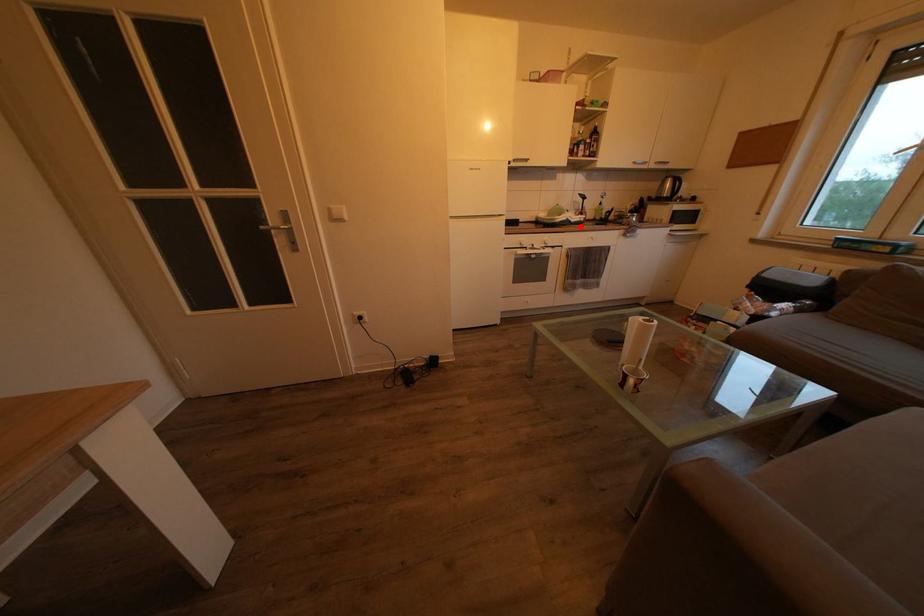
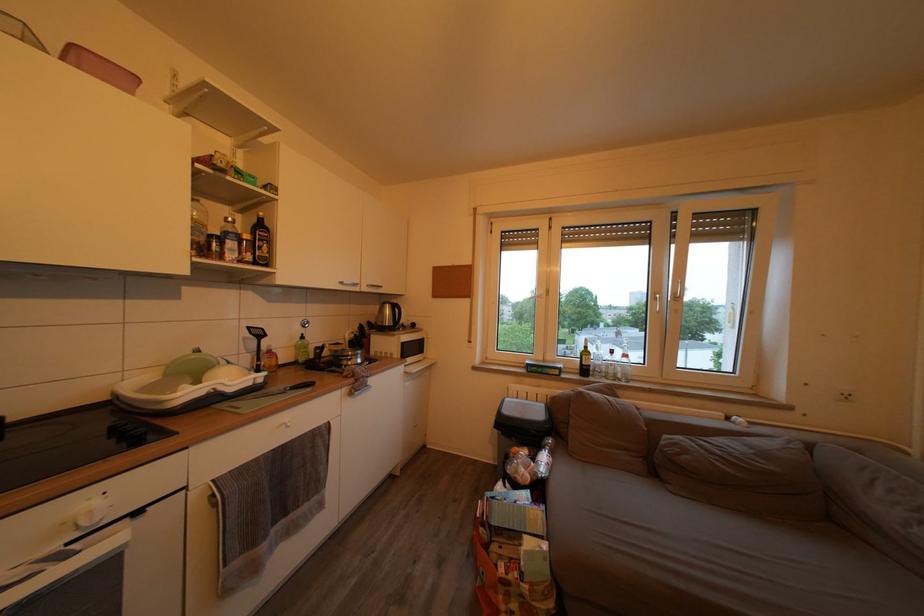
Question: I am providing you with two images of the same scene from different viewpoints. In image1, a red point is highlighted. Considering the same 3D point in image2, which of the following is correct?

Choices:
 (A) It is closer
 (B) It is farther

Answer: (B)